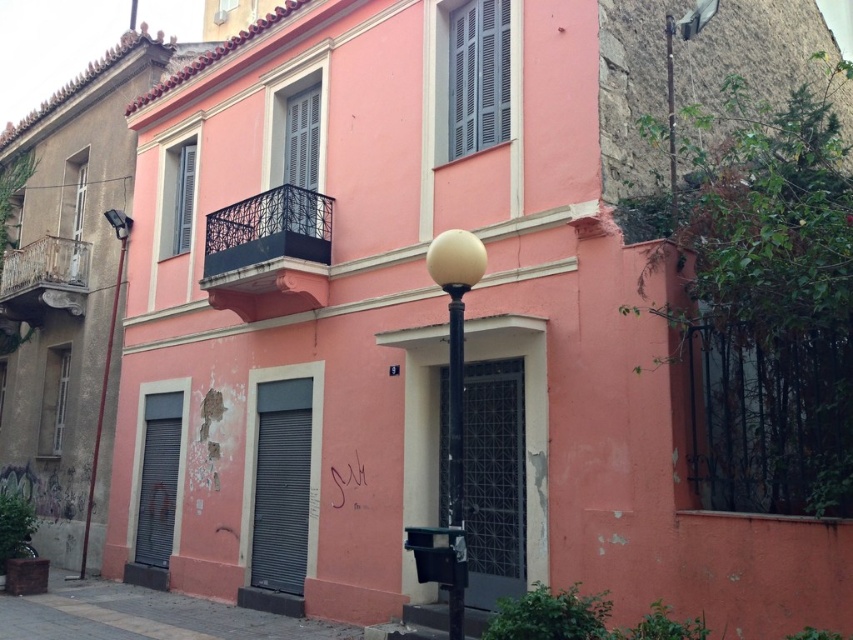
You are a delivery person trying to deliver a package to the building. The delivery instructions say to place the package at the base of the metallic pole at left. However, you notice the black wrought iron balcony at upper center is in the way. Can you safely place the package there without the balcony obstructing access?

The black wrought iron balcony at upper center is 4.86 meters away from the metallic pole at left. Since the balcony is 4.86 meters away, it is not directly blocking the path to the pole, so you can safely place the package there without obstruction.

You are a city planner assessing the placement of streetlights for optimal lighting. Given the presence of the metallic pole at left and the matte black lamp at upper left, which object would you consider for adjusting the height to ensure better illumination of the building facade? Explain your choice based on their sizes.

The metallic pole at left has a larger size compared to the matte black lamp at upper left. Since the metallic pole is larger, it can be adjusted in height more effectively to ensure better illumination of the building facade.

You are a painter who needs to decide which object to paint first. The black wrought iron balcony at upper center and the metallic pole at left are both in need of a fresh coat. Based on their sizes, which one would require more paint?

The black wrought iron balcony at upper center might be wider than metallic pole at left, so it would require more paint.